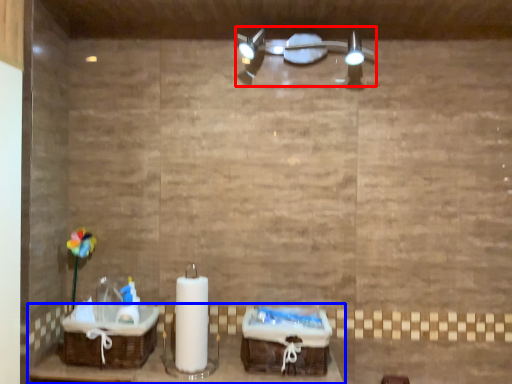
Question: Which point is closer to the camera, light fixture (highlighted by a red box) or furniture (highlighted by a blue box)?

Choices:
 (A) light fixture
 (B) furniture

Answer: (B)